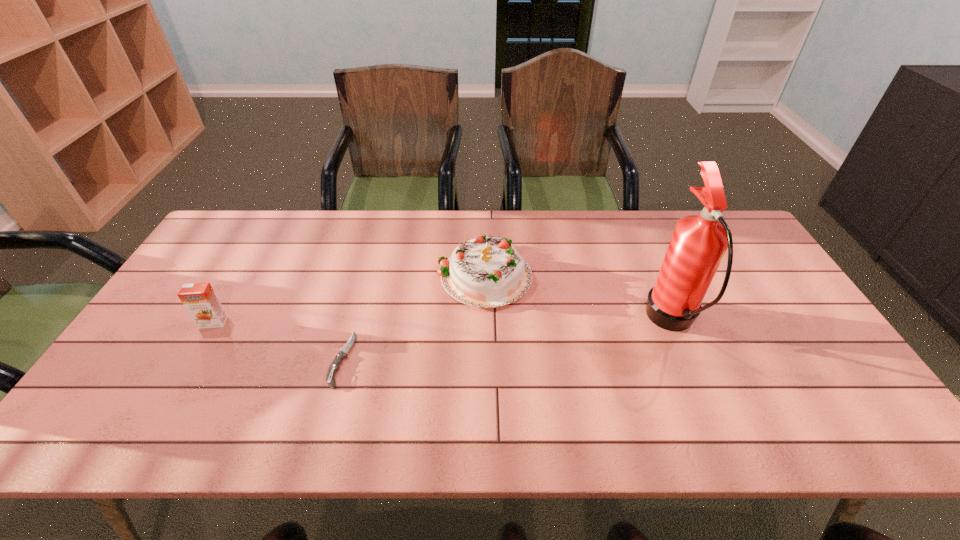
At what (x,y) coordinates should I click in order to perform the action: click on vacant region located at the spray nozzle of the fire extinguisher. Please return your answer as a coordinate pair (x, y). Looking at the image, I should click on (527, 322).

Locate an element on the screen. free space located on the front of the second tallest object is located at coordinates (485, 342).

Where is `free space located 0.080m on the front of the orange juice`? free space located 0.080m on the front of the orange juice is located at coordinates (196, 353).

At what (x,y) coordinates should I click in order to perform the action: click on vacant space located 0.250m on the back of the third object from right to left. Please return your answer as a coordinate pair (x, y). The width and height of the screenshot is (960, 540). Looking at the image, I should click on (367, 270).

Locate an element on the screen. This screenshot has height=540, width=960. object at the far edge is located at coordinates (486, 272).

Where is `object situated at the left edge`? object situated at the left edge is located at coordinates (199, 299).

In the image, there is a desktop. In order to click on vacant space at the far edge in this screenshot , I will do `click(402, 233)`.

This screenshot has width=960, height=540. In the image, there is a desktop. Identify the location of free space at the near edge. (797, 441).

The image size is (960, 540). I want to click on free space at the right edge of the desktop, so click(811, 348).

Identify the location of vacant space that's between the orange juice and the shortest object. The height and width of the screenshot is (540, 960). (277, 341).